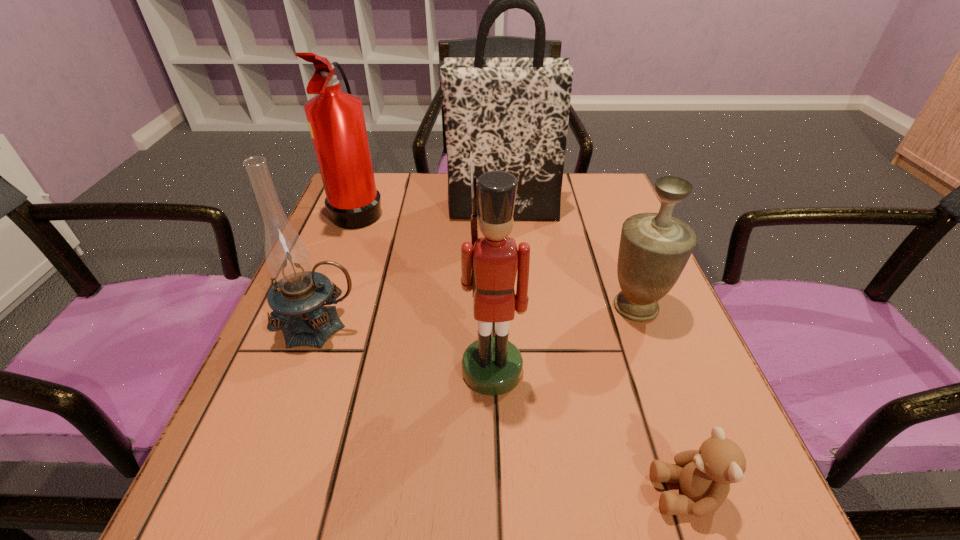
Where is `urn at the right edge`? This screenshot has height=540, width=960. urn at the right edge is located at coordinates (654, 248).

The height and width of the screenshot is (540, 960). I want to click on teddy bear positioned at the right edge, so click(x=704, y=475).

Find the location of a particular element. This screenshot has height=540, width=960. object that is at the far left corner is located at coordinates (336, 121).

At what (x,y) coordinates should I click in order to perform the action: click on object that is at the near right corner. Please return your answer as a coordinate pair (x, y). Image resolution: width=960 pixels, height=540 pixels. Looking at the image, I should click on (704, 475).

This screenshot has height=540, width=960. I want to click on vacant space at the far edge of the desktop, so click(x=427, y=194).

At what (x,y) coordinates should I click in order to perform the action: click on free location at the left edge of the desktop. Please return your answer as a coordinate pair (x, y). The width and height of the screenshot is (960, 540). Looking at the image, I should click on (213, 467).

In the image, there is a desktop. Where is `vacant space at the right edge`? This screenshot has height=540, width=960. vacant space at the right edge is located at coordinates (612, 266).

In the image, there is a desktop. Identify the location of vacant space at the near left corner. (260, 512).

This screenshot has width=960, height=540. In order to click on vacant space at the far right corner of the desktop in this screenshot , I will do `click(582, 210)`.

Locate an element on the screen. Image resolution: width=960 pixels, height=540 pixels. free space that is in between the shopping bag and the urn is located at coordinates (569, 258).